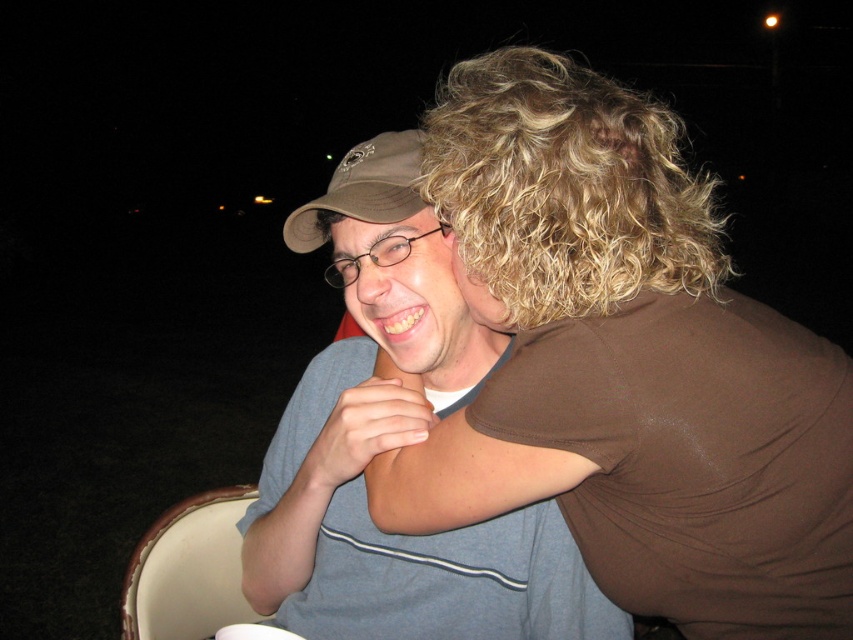
Question: Can you confirm if brown smooth t-shirt at upper right is bigger than matte brown baseball cap at upper left?

Choices:
 (A) no
 (B) yes

Answer: (A)

Question: Which object is positioned closest to the matte brown baseball cap at upper left?

Choices:
 (A) matte gray shirt at center
 (B) curly blonde hair at upper right
 (C) brown smooth t-shirt at upper right
 (D) brown matte shirt at upper right

Answer: (B)

Question: Does matte gray shirt at center appear over matte brown baseball cap at upper left?

Choices:
 (A) no
 (B) yes

Answer: (A)

Question: Can you confirm if brown matte shirt at upper right is thinner than matte brown baseball cap at upper left?

Choices:
 (A) yes
 (B) no

Answer: (B)

Question: Which object is farther from the camera taking this photo?

Choices:
 (A) matte gray shirt at center
 (B) brown matte shirt at upper right
 (C) curly blonde hair at upper right

Answer: (A)

Question: Which point is farther from the camera taking this photo?

Choices:
 (A) (325, 209)
 (B) (724, 538)
 (C) (775, 401)

Answer: (A)